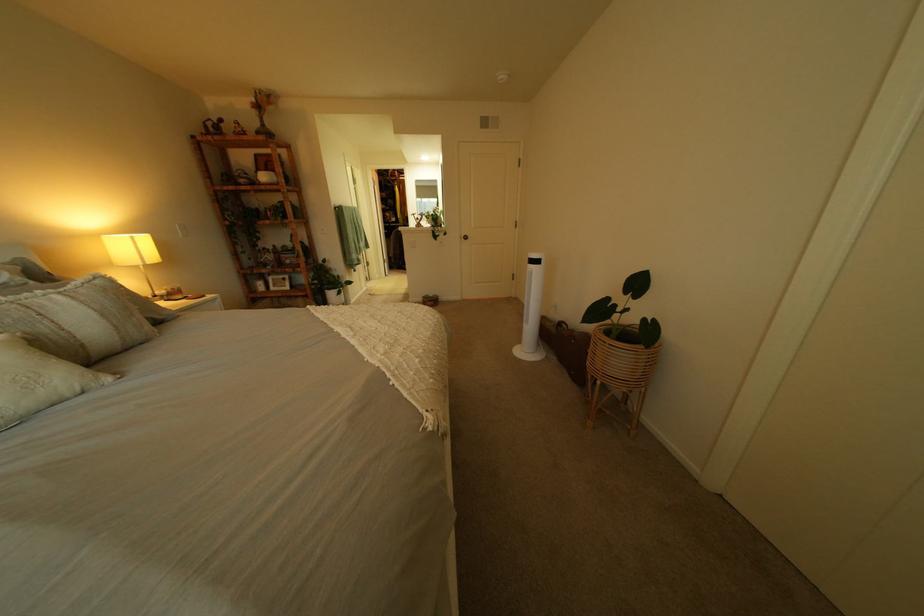
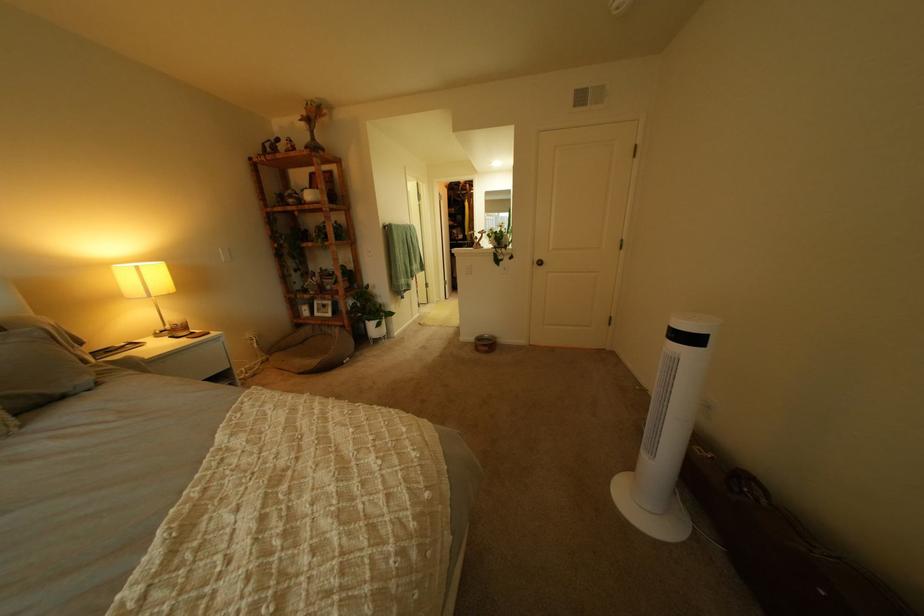
Find the pixel in the second image that matches (x=435, y=301) in the first image.

(489, 339)